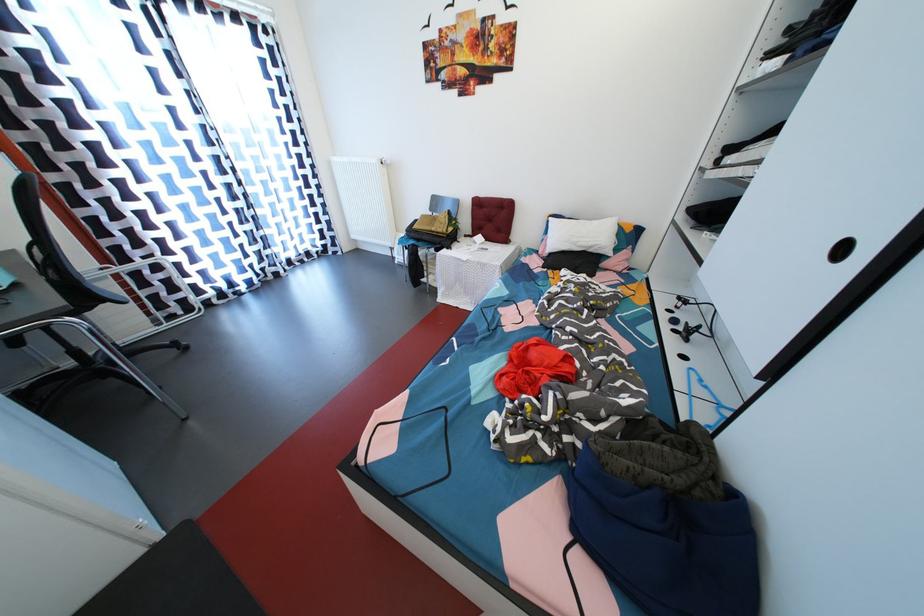
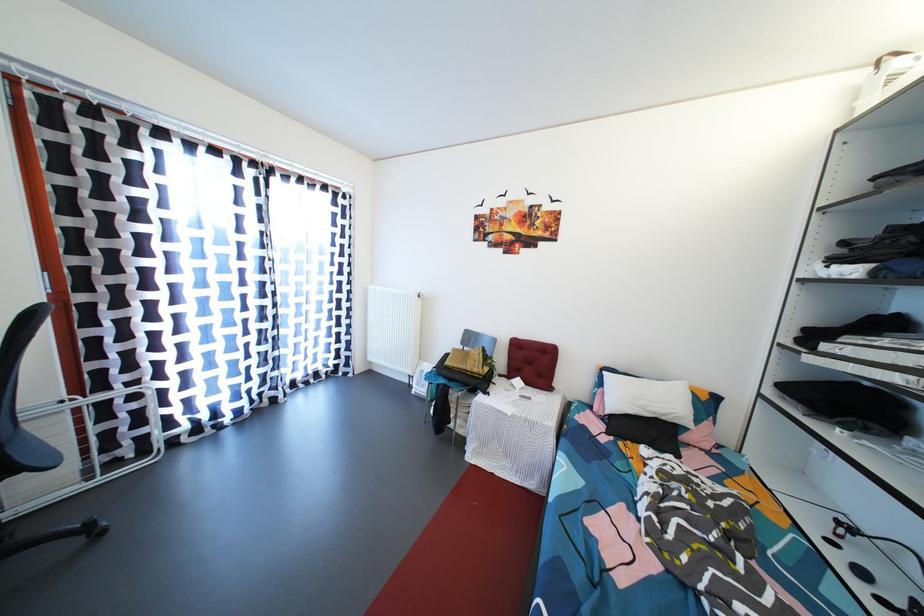
What movement of the cameraman would produce the second image?

The cameraman walked toward left, forward.